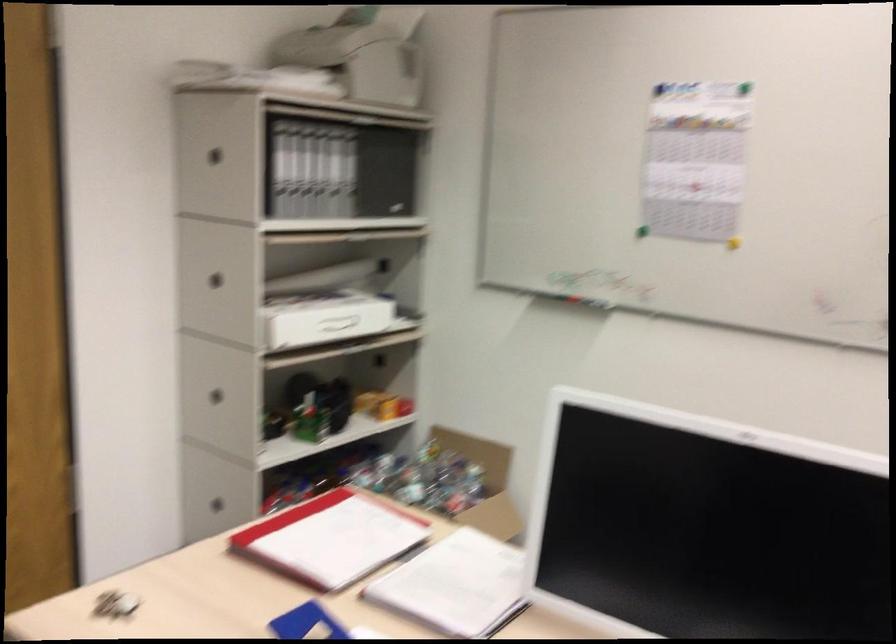
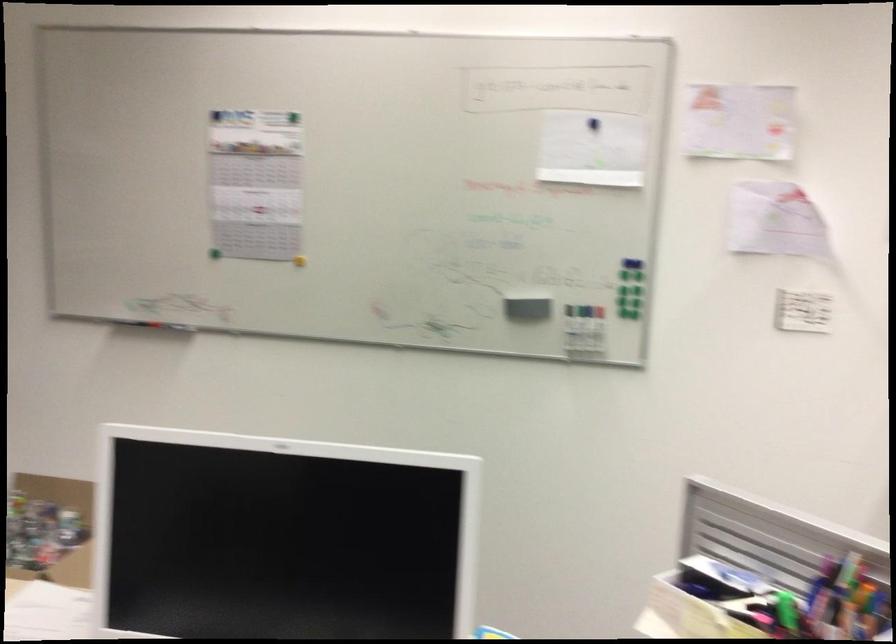
Where in the second image is the point corresponding to [634,228] from the first image?

(213, 252)